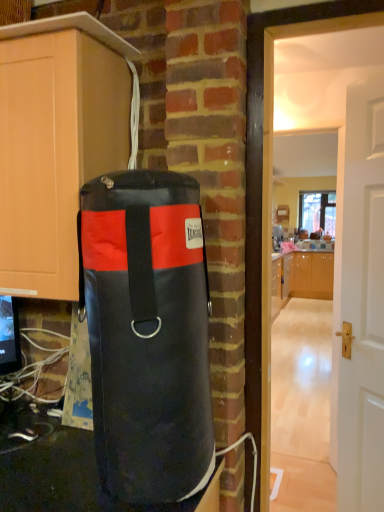
Question: Is black leather punching bag at left inside or outside of matte wood cabinet at left, acting as the 1th cabinetry starting from the left?

Choices:
 (A) inside
 (B) outside

Answer: (B)

Question: Considering the positions of black leather punching bag at left and matte wood cabinet at left, arranged as the second cabinetry when viewed from the right, in the image, is black leather punching bag at left wider or thinner than matte wood cabinet at left, arranged as the second cabinetry when viewed from the right,?

Choices:
 (A) wide
 (B) thin

Answer: (B)

Question: Which object is the farthest from the glossy wood cabinets at center, arranged as the 2th cabinetry when viewed from the front?

Choices:
 (A) black leather punching bag at left
 (B) white glossy door at center right
 (C) matte wood cabinet at left, arranged as the second cabinetry when viewed from the right

Answer: (A)

Question: Which object is the closest to the white glossy door at center right?

Choices:
 (A) glossy wood cabinets at center, the 1th cabinetry from the back
 (B) matte wood cabinet at left, the 2th cabinetry when ordered from back to front
 (C) black leather punching bag at left

Answer: (C)